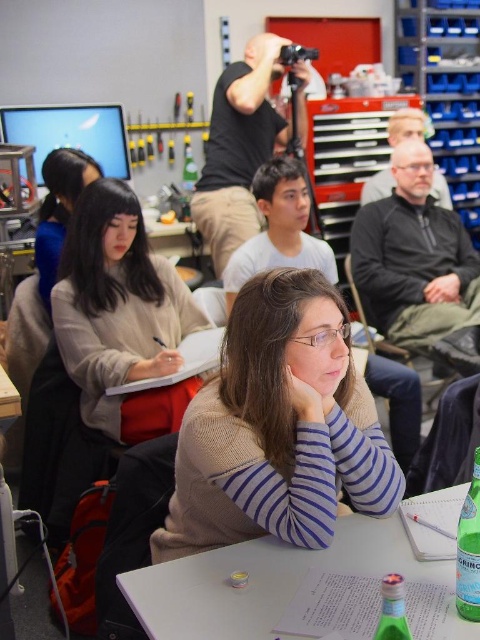
Question: Does light beige sweater at center appear over green glass bottle at center?

Choices:
 (A) yes
 (B) no

Answer: (A)

Question: Which object is the closest to the green glass bottle at lower right?

Choices:
 (A) white plastic table at center
 (B) green glass bottle at center

Answer: (B)

Question: Which object is the farthest from the knit sweater at center?

Choices:
 (A) green glass bottle at center
 (B) white plastic table at center
 (C) light beige sweater at center
 (D) green glass bottle at lower right

Answer: (C)

Question: Is knit sweater at center further to the viewer compared to green glass bottle at lower right?

Choices:
 (A) no
 (B) yes

Answer: (B)

Question: Does light beige sweater at center have a greater width compared to green glass bottle at center?

Choices:
 (A) yes
 (B) no

Answer: (A)

Question: Estimate the real-world distances between objects in this image. Which object is closer to the green glass bottle at center?

Choices:
 (A) light beige sweater at center
 (B) white plastic table at center
 (C) knit sweater at center
 (D) green glass bottle at lower right

Answer: (D)